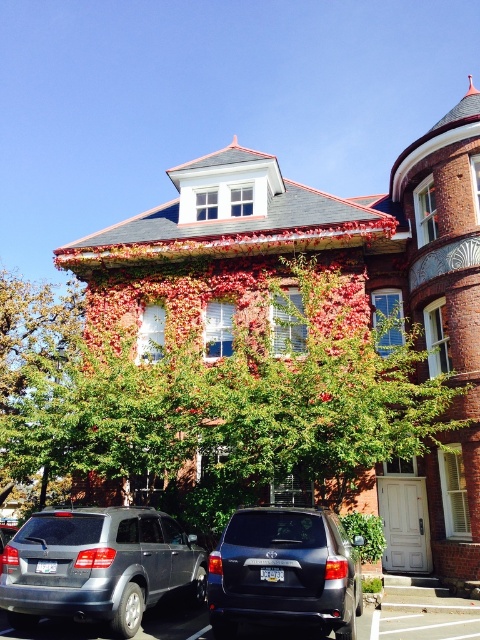
Question: Can you confirm if green leafy tree at center is thinner than matte black suv at center?

Choices:
 (A) no
 (B) yes

Answer: (A)

Question: Among these points, which one is farthest from the camera?

Choices:
 (A) (50, 579)
 (B) (286, 580)
 (C) (436, 433)

Answer: (C)

Question: In this image, where is green leafy tree at center located relative to satin gray suv at lower left?

Choices:
 (A) left
 (B) right

Answer: (A)

Question: Estimate the real-world distances between objects in this image. Which object is farther from the green leafy tree at center?

Choices:
 (A) satin gray suv at lower left
 (B) matte black suv at center

Answer: (B)

Question: Which point appears closest to the camera in this image?

Choices:
 (A) (180, 426)
 (B) (159, 536)
 (C) (289, 544)

Answer: (C)

Question: Is satin gray suv at lower left to the right of matte black suv at center from the viewer's perspective?

Choices:
 (A) yes
 (B) no

Answer: (B)